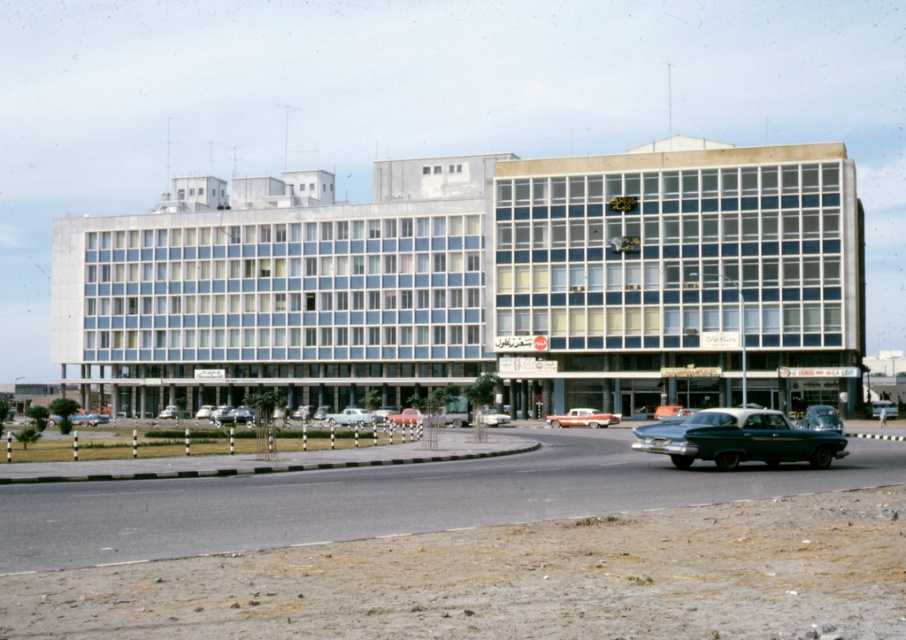
Which is more to the left, orange metallic car at center or matte red car at center?

matte red car at center is more to the left.

Does orange metallic car at center have a lesser height compared to matte red car at center?

In fact, orange metallic car at center may be taller than matte red car at center.

Where is `orange metallic car at center`? The width and height of the screenshot is (906, 640). orange metallic car at center is located at coordinates (405, 417).

Where is `orange metallic car at center`? This screenshot has height=640, width=906. orange metallic car at center is located at coordinates tap(405, 417).

Is point (217, 420) less distant than point (369, 412)?

Yes, it is.

From the picture: Does shiny silver sedan at center lie behind light blue metallic sedan at center?

No.

Does point (225, 420) come behind point (369, 416)?

That is True.

The height and width of the screenshot is (640, 906). What are the coordinates of `shiny silver sedan at center` in the screenshot? It's located at (234, 416).

Is light blue metallic sedan at center thinner than shiny orange car at center?

No.

Is light blue metallic sedan at center wider than shiny orange car at center?

Correct, the width of light blue metallic sedan at center exceeds that of shiny orange car at center.

Find the location of `light blue metallic sedan at center`. light blue metallic sedan at center is located at coordinates (350, 417).